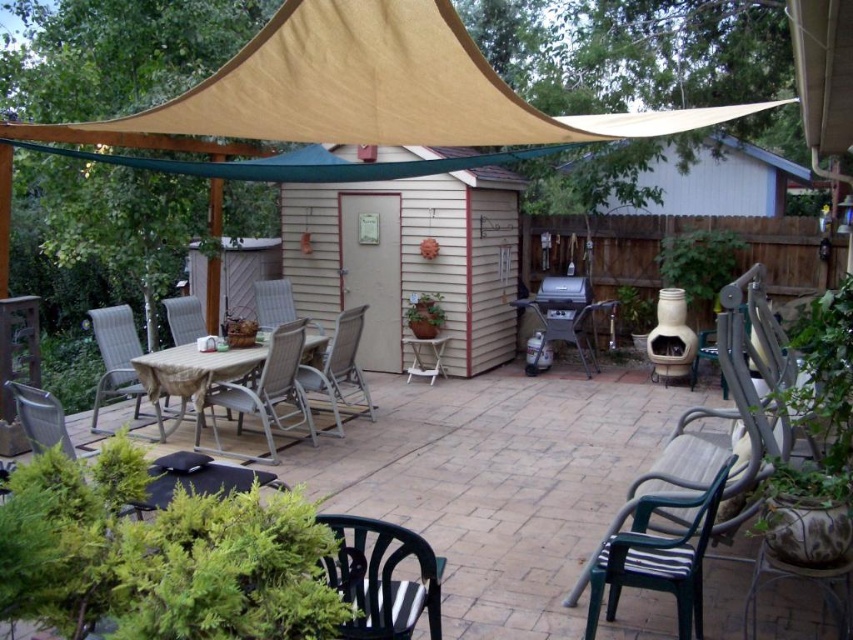
Consider the image. You are planning to seat guests at the patio table. You have a black plastic chair at lower left and a metallic silver chair at center. Which chair is shorter and better suited for shorter guests?

The black plastic chair at lower left is not as tall as the metallic silver chair at center, so it is shorter and better suited for shorter guests.